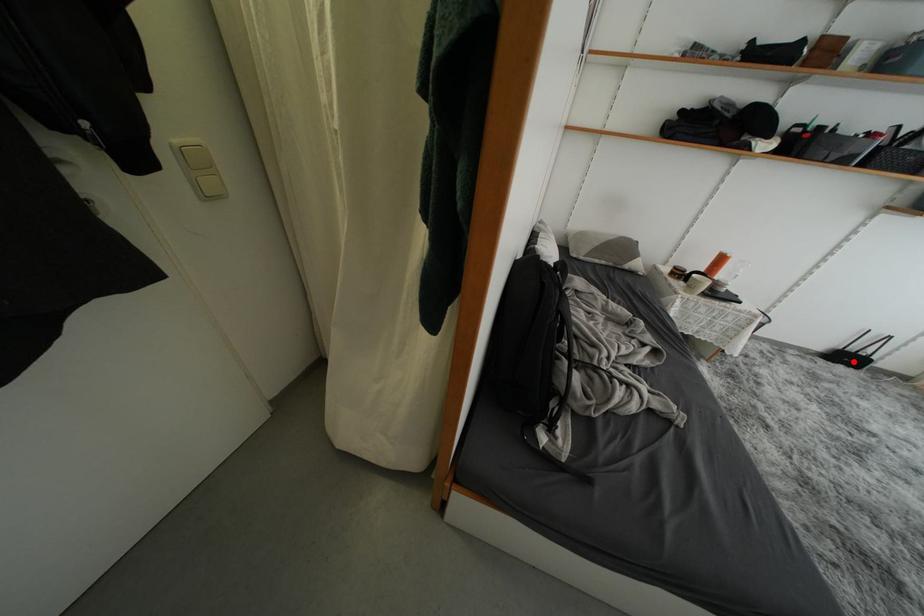
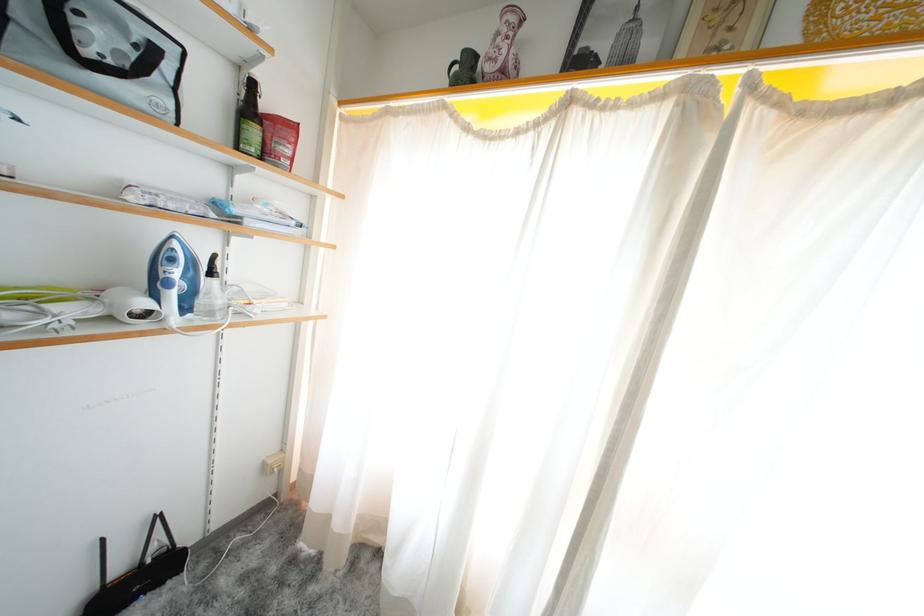
Locate, in the second image, the point that corresponds to the highlighted location in the first image.

(143, 586)